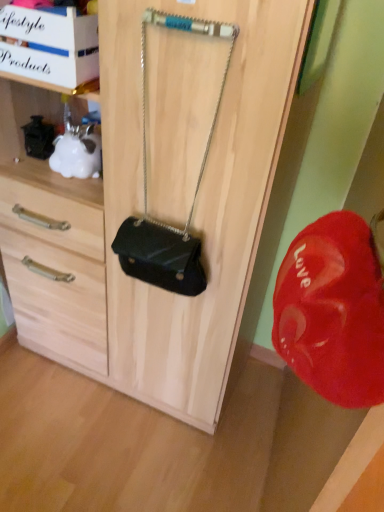
Question: Are matte black purse at center and black leather handbag at center far apart?

Choices:
 (A) no
 (B) yes

Answer: (A)

Question: Considering the relative positions of matte black purse at center and black leather handbag at center in the image provided, is matte black purse at center to the left of black leather handbag at center from the viewer's perspective?

Choices:
 (A) no
 (B) yes

Answer: (B)

Question: From the image's perspective, is matte black purse at center beneath black leather handbag at center?

Choices:
 (A) no
 (B) yes

Answer: (B)

Question: Is matte black purse at center further to camera compared to black leather handbag at center?

Choices:
 (A) yes
 (B) no

Answer: (A)

Question: From the image's perspective, does matte black purse at center appear higher than black leather handbag at center?

Choices:
 (A) no
 (B) yes

Answer: (A)

Question: From a real-world perspective, is matte black purse at center beneath black leather handbag at center?

Choices:
 (A) no
 (B) yes

Answer: (B)

Question: Is black leather handbag at center at the left side of matte black purse at center?

Choices:
 (A) yes
 (B) no

Answer: (B)

Question: Is black leather handbag at center positioned with its back to matte black purse at center?

Choices:
 (A) no
 (B) yes

Answer: (B)

Question: From the image's perspective, would you say black leather handbag at center is shown under matte black purse at center?

Choices:
 (A) yes
 (B) no

Answer: (B)

Question: From a real-world perspective, is black leather handbag at center positioned under matte black purse at center based on gravity?

Choices:
 (A) no
 (B) yes

Answer: (A)

Question: Is black leather handbag at center located outside matte black purse at center?

Choices:
 (A) no
 (B) yes

Answer: (A)

Question: Is black leather handbag at center wider than matte black purse at center?

Choices:
 (A) yes
 (B) no

Answer: (B)

Question: Considering the positions of point (139, 270) and point (258, 136), is point (139, 270) closer or farther from the camera than point (258, 136)?

Choices:
 (A) closer
 (B) farther

Answer: (B)